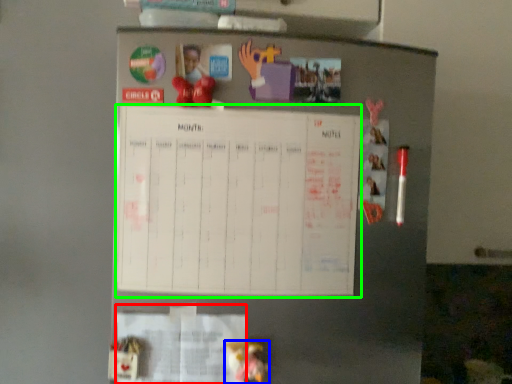
Question: Which object is the farthest from paper (highlighted by a red box)? Choose among these: toy (highlighted by a blue box) or bulletin board (highlighted by a green box).

Choices:
 (A) toy
 (B) bulletin board

Answer: (B)